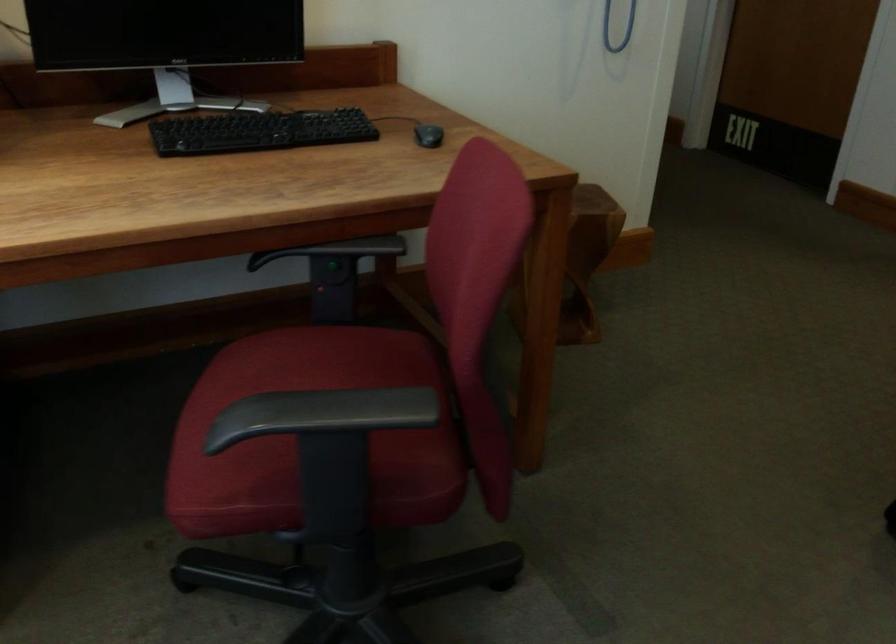
This screenshot has height=644, width=896. I want to click on black computer mouse, so click(x=427, y=135).